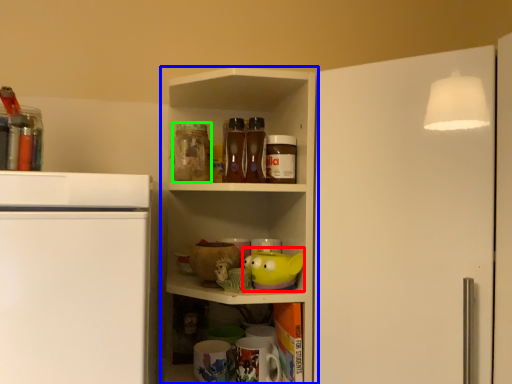
Question: Which object is positioned farthest from toy (highlighted by a red box)? Select from shelf (highlighted by a blue box) and beverage (highlighted by a green box).

Choices:
 (A) shelf
 (B) beverage

Answer: (A)